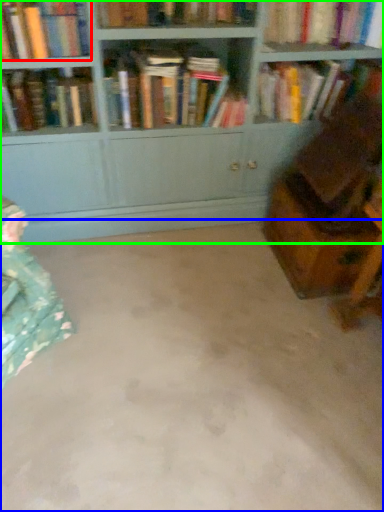
Question: Estimate the real-world distances between objects in this image. Which object is farther from book (highlighted by a red box), concrete (highlighted by a blue box) or bookcase (highlighted by a green box)?

Choices:
 (A) concrete
 (B) bookcase

Answer: (A)